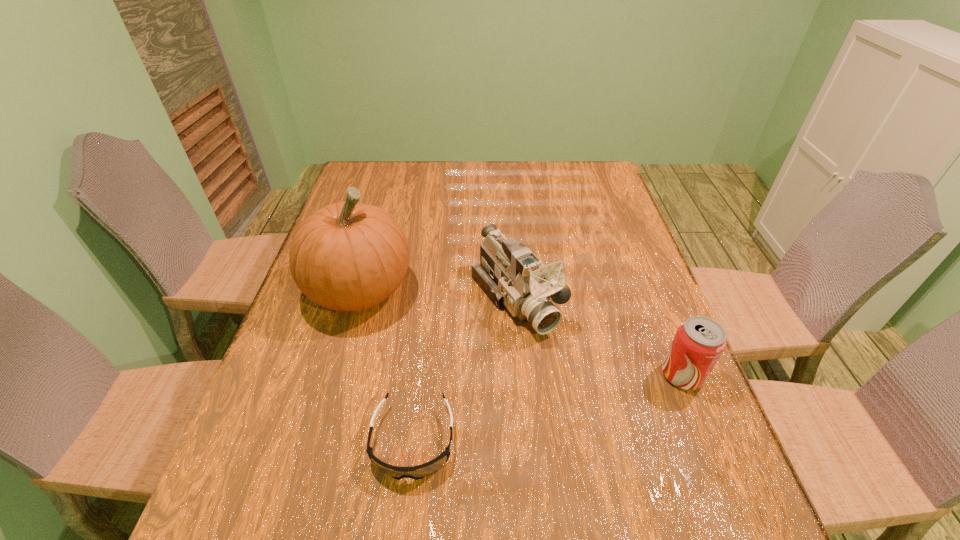
Identify the location of blank space at the near left corner. (261, 479).

The height and width of the screenshot is (540, 960). In order to click on vacant region at the far right corner of the desktop in this screenshot , I will do `click(576, 170)`.

Identify the location of empty space between the goggles and the third farthest object. (547, 408).

The height and width of the screenshot is (540, 960). Find the location of `free spot between the third shortest object and the pumpkin`. free spot between the third shortest object and the pumpkin is located at coordinates (438, 295).

You are a GUI agent. You are given a task and a screenshot of the screen. Output one action in this format:
    pyautogui.click(x=<x>, y=<y>)
    Task: Click on the vacant area that lies between the third object from left to right and the goggles
    
    Given the screenshot: What is the action you would take?
    pyautogui.click(x=465, y=370)

The height and width of the screenshot is (540, 960). In order to click on free spot between the nearest object and the second shortest object in this screenshot , I will do `click(547, 408)`.

You are a GUI agent. You are given a task and a screenshot of the screen. Output one action in this format:
    pyautogui.click(x=<x>, y=<y>)
    Task: Click on the free space between the camcorder and the tallest object
    The image size is (960, 540).
    Given the screenshot: What is the action you would take?
    pyautogui.click(x=438, y=295)

Locate an element on the screen. Image resolution: width=960 pixels, height=540 pixels. free space between the goggles and the rightmost object is located at coordinates (547, 408).

Image resolution: width=960 pixels, height=540 pixels. In order to click on free space between the camcorder and the pumpkin in this screenshot , I will do `click(438, 295)`.

This screenshot has height=540, width=960. I want to click on free space between the tallest object and the goggles, so click(x=386, y=365).